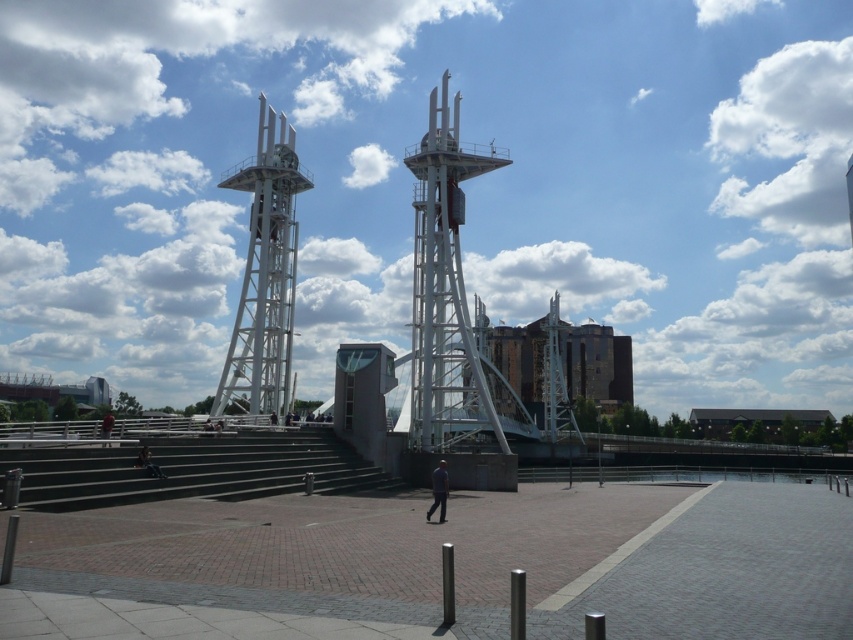
Looking at this image, is white metallic tower at center to the right of dark gray fabric jacket at center from the viewer's perspective?

Yes, white metallic tower at center is to the right of dark gray fabric jacket at center.

Is point (509, 160) farther from camera compared to point (442, 509)?

Yes, it is behind point (442, 509).

Where is `white metallic tower at center`? white metallic tower at center is located at coordinates (445, 289).

Between white metallic tower at center and white metallic tower at upper left, which one has more height?

Standing taller between the two is white metallic tower at center.

Which is in front, point (445, 129) or point (225, 394)?

Point (445, 129) is more forward.

Between point (473, 401) and point (253, 184), which one is positioned behind?

Positioned behind is point (473, 401).

At what (x,y) coordinates should I click in order to perform the action: click on white metallic tower at center. Please return your answer as a coordinate pair (x, y). Looking at the image, I should click on (445, 289).

Find the location of a particular element. Image resolution: width=853 pixels, height=640 pixels. white metallic tower at center is located at coordinates pos(445,289).

Which of these two, white metallic tower at center or red fabric person at lower left, stands shorter?

Standing shorter between the two is red fabric person at lower left.

Locate an element on the screen. The height and width of the screenshot is (640, 853). white metallic tower at center is located at coordinates (445, 289).